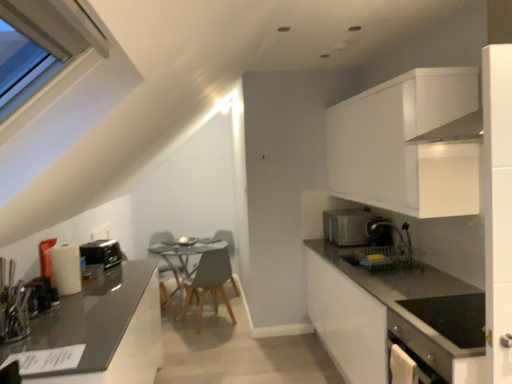
Identify the location of vacant space situated on the left part of satin black coffee machine at right. The image size is (512, 384). (351, 249).